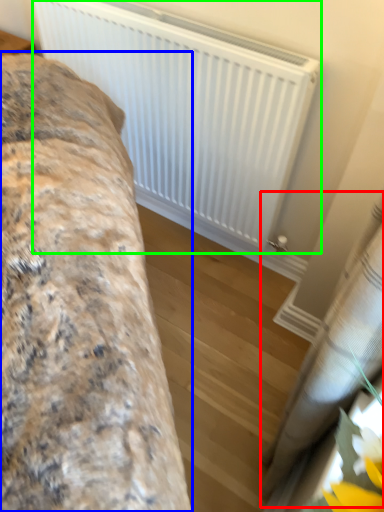
Question: Which object is positioned farthest from curtain (highlighted by a red box)? Select from furniture (highlighted by a blue box) and radiator (highlighted by a green box).

Choices:
 (A) furniture
 (B) radiator

Answer: (B)